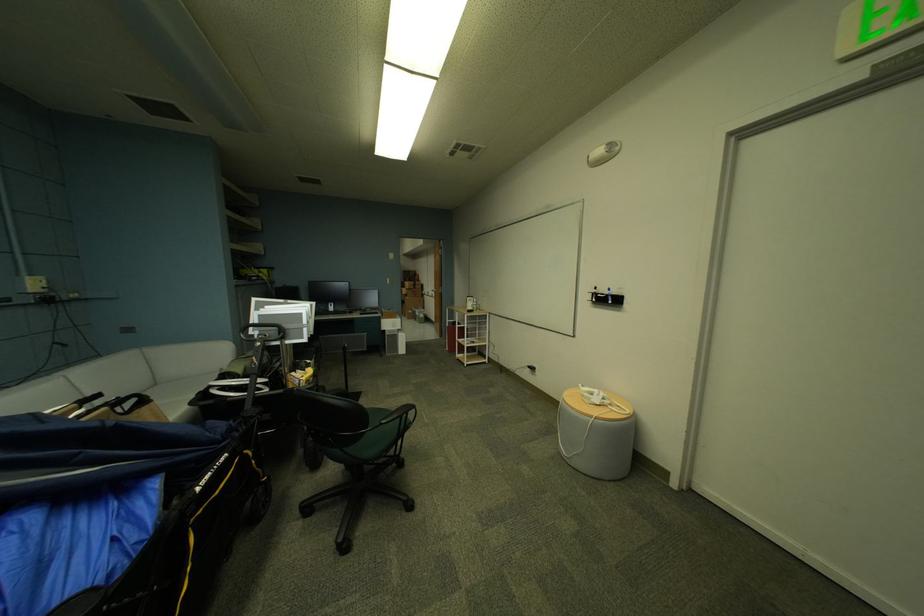
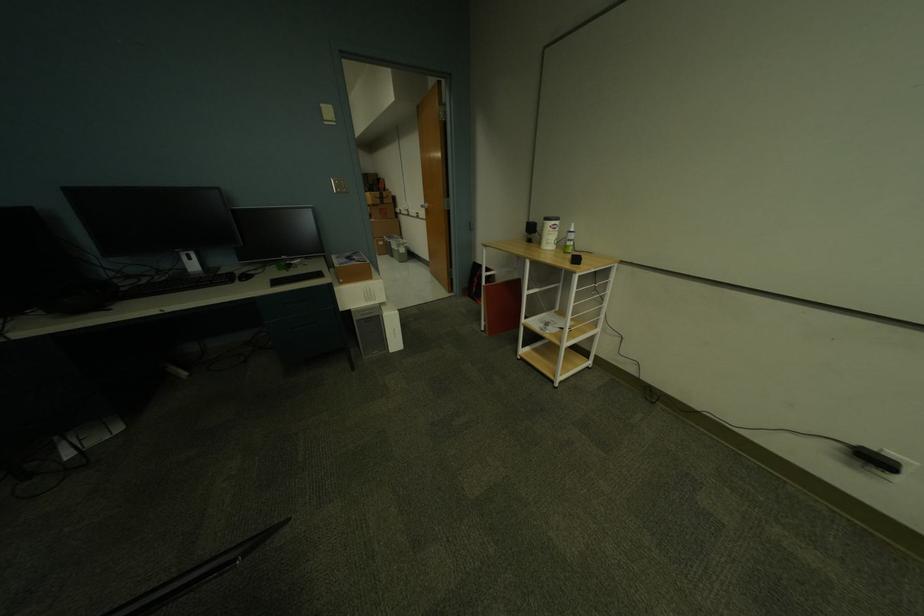
Question: Which direction would the cameraman need to move to produce the second image? Reply with the corresponding letter.

Choices:
 (A) Left
 (B) Right
 (C) Forward
 (D) Backward

Answer: (C)